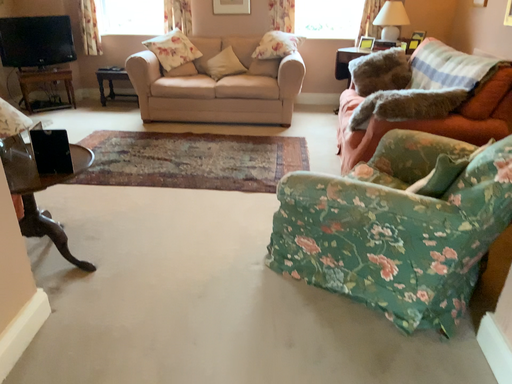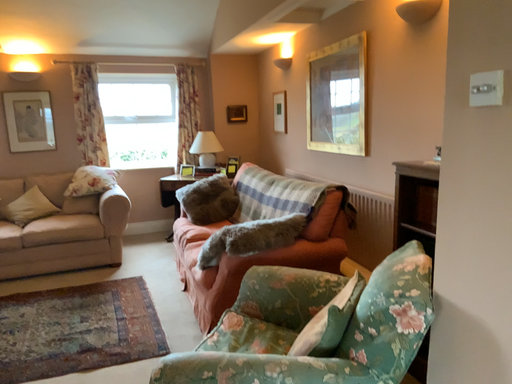
Question: How did the camera likely rotate when shooting the video?

Choices:
 (A) rotated left
 (B) rotated right

Answer: (B)